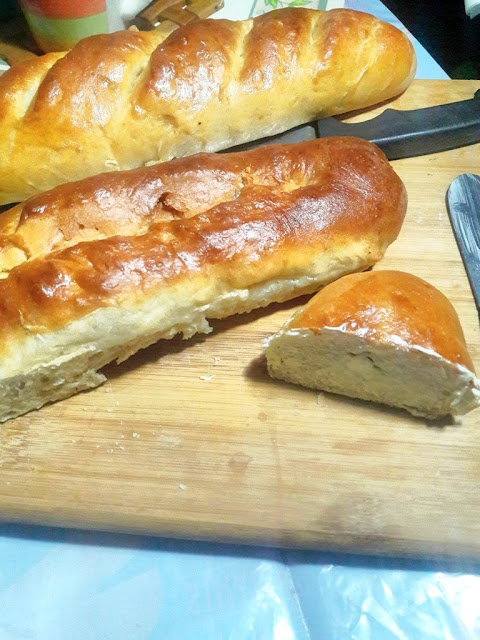
You are a GUI agent. You are given a task and a screenshot of the screen. Output one action in this format:
    pyautogui.click(x=<x>, y=<y>)
    Task: Click on the knife handle
    The width and height of the screenshot is (480, 640).
    Given the screenshot: What is the action you would take?
    pyautogui.click(x=397, y=120)